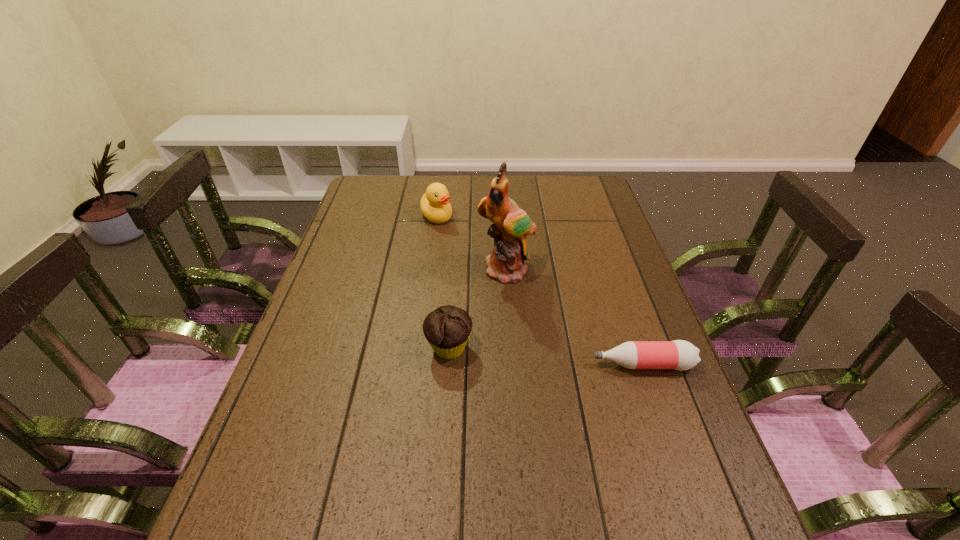
Image resolution: width=960 pixels, height=540 pixels. I want to click on vacant space situated 0.090m with the cap open on the bottle, so click(554, 364).

The width and height of the screenshot is (960, 540). In order to click on vacant space located 0.120m at the beak of the farthest object in this screenshot , I will do `click(457, 245)`.

Where is `free space located at the beak of the farthest object`? free space located at the beak of the farthest object is located at coordinates (451, 237).

At what (x,y) coordinates should I click in order to perform the action: click on vacant region located at the beak of the farthest object. Please return your answer as a coordinate pair (x, y). Looking at the image, I should click on (472, 264).

Locate an element on the screen. This screenshot has height=540, width=960. vacant space situated on the front-facing side of the third nearest object is located at coordinates (521, 323).

What are the coordinates of `free location located 0.130m on the front-facing side of the third nearest object` in the screenshot? It's located at (520, 320).

You are a GUI agent. You are given a task and a screenshot of the screen. Output one action in this format:
    pyautogui.click(x=<x>, y=<y>)
    Task: Click on the vacant space situated on the front-facing side of the third nearest object
    
    Given the screenshot: What is the action you would take?
    pyautogui.click(x=516, y=304)

Identify the location of object located at the far edge. (434, 204).

This screenshot has width=960, height=540. I want to click on object present at the right edge, so click(x=681, y=355).

I want to click on vacant area at the far edge of the desktop, so coord(550,190).